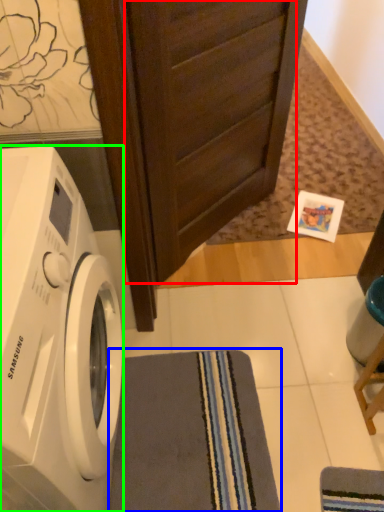
Question: Considering the real-world distances, which object is farthest from screen door (highlighted by a red box)? bath towel (highlighted by a blue box) or washing machine (highlighted by a green box)?

Choices:
 (A) bath towel
 (B) washing machine

Answer: (A)